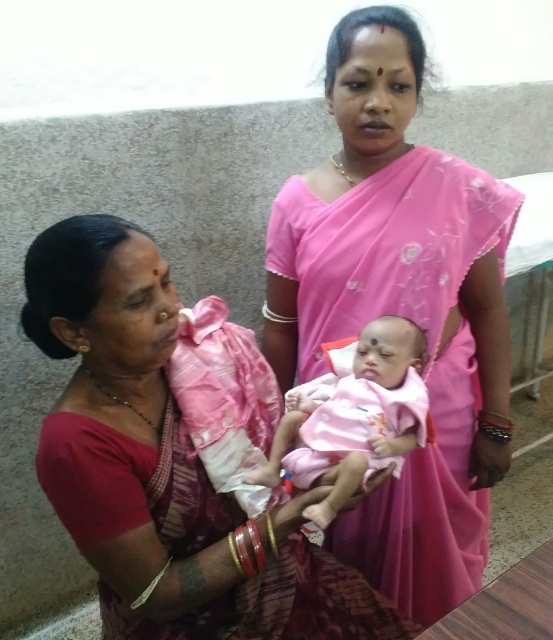
Question: Among these points, which one is farthest from the camera?

Choices:
 (A) (378, 312)
 (B) (279, 524)

Answer: (A)

Question: Which object is closer to the camera taking this photo?

Choices:
 (A) pink fabric baby at center
 (B) pink silk saree at center
 (C) matte pink saree at center

Answer: (A)

Question: From the image, what is the correct spatial relationship of matte pink saree at center in relation to pink fabric baby at center?

Choices:
 (A) right
 (B) left

Answer: (B)

Question: Does matte pink saree at center have a lesser width compared to pink fabric baby at center?

Choices:
 (A) yes
 (B) no

Answer: (B)

Question: Does matte pink saree at center appear on the left side of pink fabric baby at center?

Choices:
 (A) no
 (B) yes

Answer: (B)

Question: Which point appears farthest from the camera in this image?

Choices:
 (A) (289, 209)
 (B) (232, 513)
 (C) (357, 476)

Answer: (A)